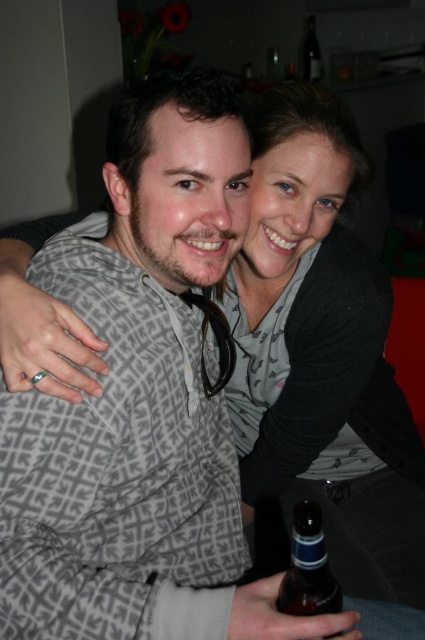
You are a bartender who needs to grab a bottle for a customer. You see the brown glass bottle at lower center and the transparent glass bottle at upper center. Which one is closer to you?

The brown glass bottle at lower center is closer because it is in front of the transparent glass bottle at upper center.